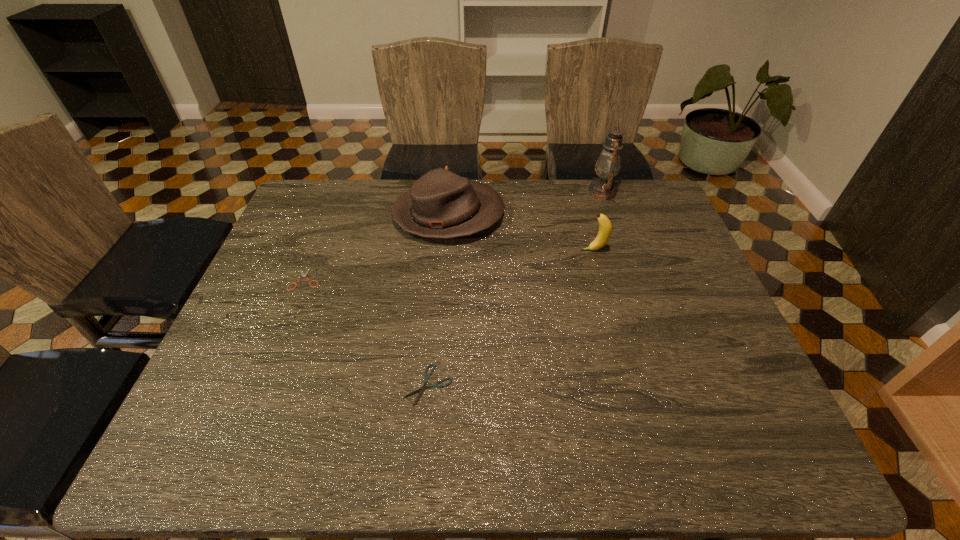
Identify the location of vacant region located 0.100m from the stem of the banana. (546, 250).

The image size is (960, 540). Find the location of `vacant region located 0.290m from the stem of the banana`. vacant region located 0.290m from the stem of the banana is located at coordinates (x=481, y=250).

The image size is (960, 540). Identify the location of free space located 0.350m on the right of the nearer shears. (612, 385).

At what (x,y) coordinates should I click in order to perform the action: click on vacant space located 0.100m on the front of the leftmost object. Please return your answer as a coordinate pair (x, y). The width and height of the screenshot is (960, 540). Looking at the image, I should click on (290, 320).

You are a GUI agent. You are given a task and a screenshot of the screen. Output one action in this format:
    pyautogui.click(x=<x>, y=<y>)
    Task: Click on the oil lamp present at the far edge
    The width and height of the screenshot is (960, 540).
    Given the screenshot: What is the action you would take?
    pyautogui.click(x=608, y=164)

This screenshot has height=540, width=960. I want to click on hat located in the far edge section of the desktop, so click(x=441, y=204).

This screenshot has height=540, width=960. Identify the location of object at the left edge. (303, 275).

The height and width of the screenshot is (540, 960). I want to click on object present at the right edge, so click(608, 164).

Where is `object at the far right corner`? This screenshot has width=960, height=540. object at the far right corner is located at coordinates click(x=608, y=164).

In the image, there is a desktop. Identify the location of free space at the far edge. This screenshot has height=540, width=960. (403, 191).